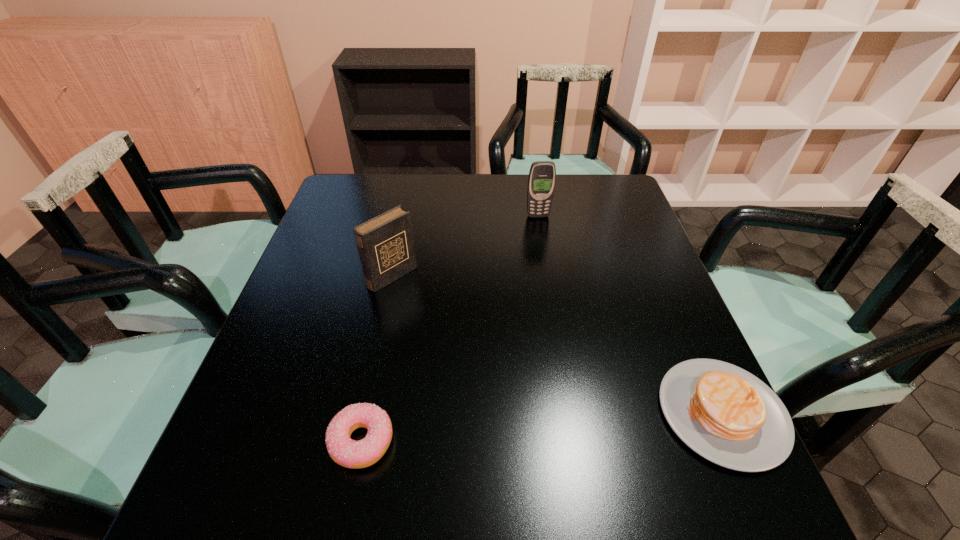
Find the location of a particular element. vacant area between the second object from right to left and the second farthest object is located at coordinates (x=466, y=246).

Find the location of a particular element. vacant area between the diary and the cellular telephone is located at coordinates (466, 246).

Where is `empty space between the third tallest object and the cellular telephone`? This screenshot has width=960, height=540. empty space between the third tallest object and the cellular telephone is located at coordinates (630, 314).

Identify the location of unoccupied position between the shortest object and the farthest object. This screenshot has height=540, width=960. (450, 329).

At what (x,y) coordinates should I click in order to perform the action: click on object that is the closest to the shortest object. Please return your answer as a coordinate pair (x, y). This screenshot has height=540, width=960. Looking at the image, I should click on (385, 243).

Locate an element on the screen. The width and height of the screenshot is (960, 540). object that can be found as the third closest to the cellular telephone is located at coordinates (346, 452).

What are the coordinates of `free location that satisfies the following two spatial constraints: 1. on the back side of the doughnut; 2. on the left side of the third tallest object` in the screenshot? It's located at (368, 413).

Where is `blank area in the image that satisfies the following two spatial constraints: 1. on the front side of the shortest object; 2. on the left side of the diary`? The height and width of the screenshot is (540, 960). blank area in the image that satisfies the following two spatial constraints: 1. on the front side of the shortest object; 2. on the left side of the diary is located at coordinates (357, 441).

Identify the location of vacant space that satisfies the following two spatial constraints: 1. on the front side of the doughnut; 2. on the right side of the third nearest object. Image resolution: width=960 pixels, height=540 pixels. (357, 441).

Where is `vacant point that satisfies the following two spatial constraints: 1. on the front side of the second farthest object; 2. on the left side of the pancake`? vacant point that satisfies the following two spatial constraints: 1. on the front side of the second farthest object; 2. on the left side of the pancake is located at coordinates click(363, 413).